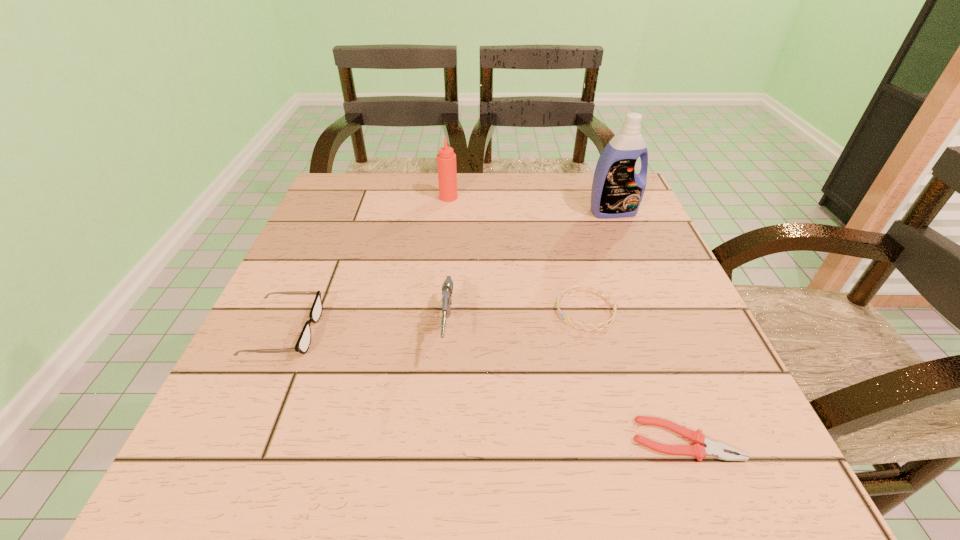
Where is `free space in the image that satisfies the following two spatial constraints: 1. at the barrel of the shortest object; 2. on the left side of the fourth shortest object`? The image size is (960, 540). free space in the image that satisfies the following two spatial constraints: 1. at the barrel of the shortest object; 2. on the left side of the fourth shortest object is located at coordinates (440, 440).

This screenshot has height=540, width=960. Find the location of `vacant area in the image that satisfies the following two spatial constraints: 1. on the front-facing side of the third shortest object; 2. on the right side of the nearest object`. vacant area in the image that satisfies the following two spatial constraints: 1. on the front-facing side of the third shortest object; 2. on the right side of the nearest object is located at coordinates (236, 440).

Locate an element on the screen. blank space that satisfies the following two spatial constraints: 1. on the back side of the nearest object; 2. on the right side of the fifth nearest object is located at coordinates (599, 212).